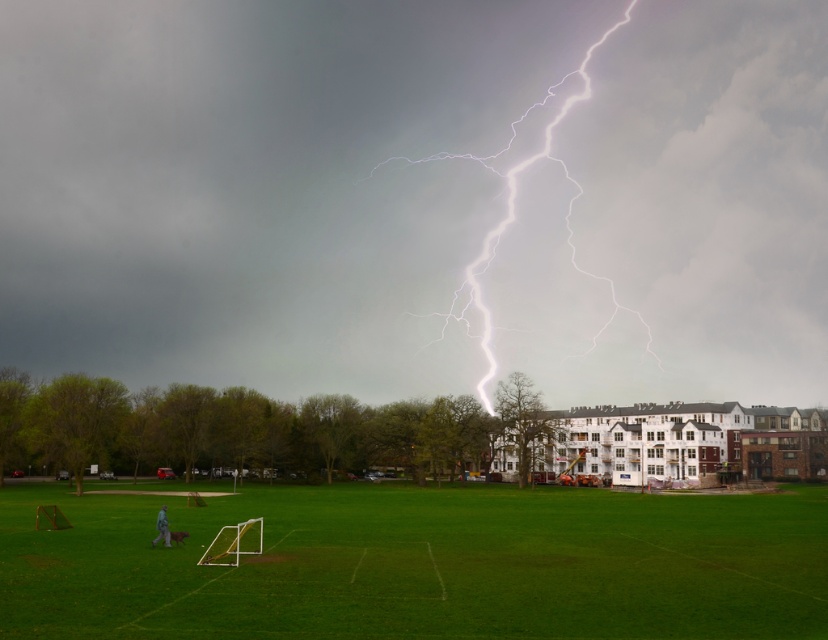
Question: Is bright white lightning at center in front of green grass field at lower center?

Choices:
 (A) no
 (B) yes

Answer: (A)

Question: Which of the following is the farthest from the observer?

Choices:
 (A) bright white lightning at center
 (B) green grass field at lower center

Answer: (A)

Question: Is bright white lightning at center to the right of green grass field at lower center from the viewer's perspective?

Choices:
 (A) yes
 (B) no

Answer: (B)

Question: Among these objects, which one is farthest from the camera?

Choices:
 (A) green grass field at lower center
 (B) bright white lightning at center

Answer: (B)

Question: Is bright white lightning at center wider than green grass field at lower center?

Choices:
 (A) no
 (B) yes

Answer: (B)

Question: Which of the following is the farthest from the observer?

Choices:
 (A) (330, 212)
 (B) (13, 548)

Answer: (A)